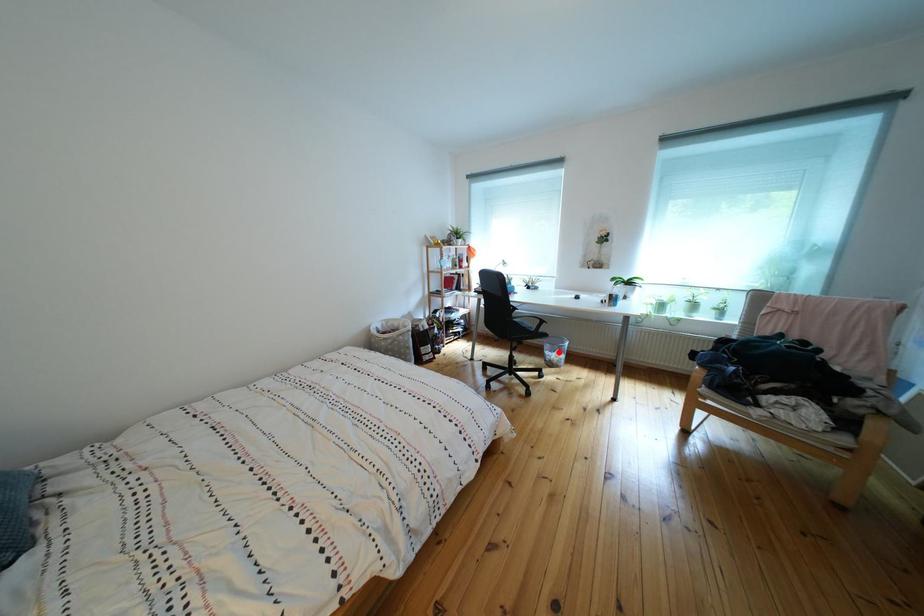
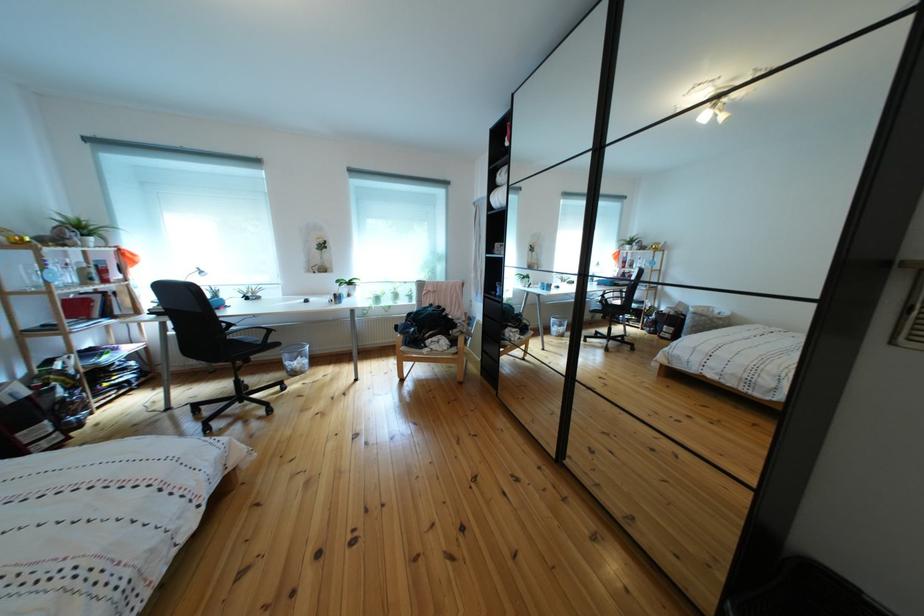
Question: I am providing you with two images of the same scene from different viewpoints. Given a red point in image1, look at the same physical point in image2. Is it:

Choices:
 (A) Closer to the viewpoint
 (B) Farther from the viewpoint

Answer: (A)